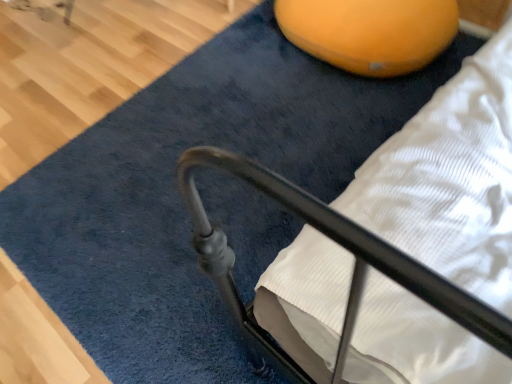
Identify the location of free space in front of matte orange cushion at upper right. (336, 123).